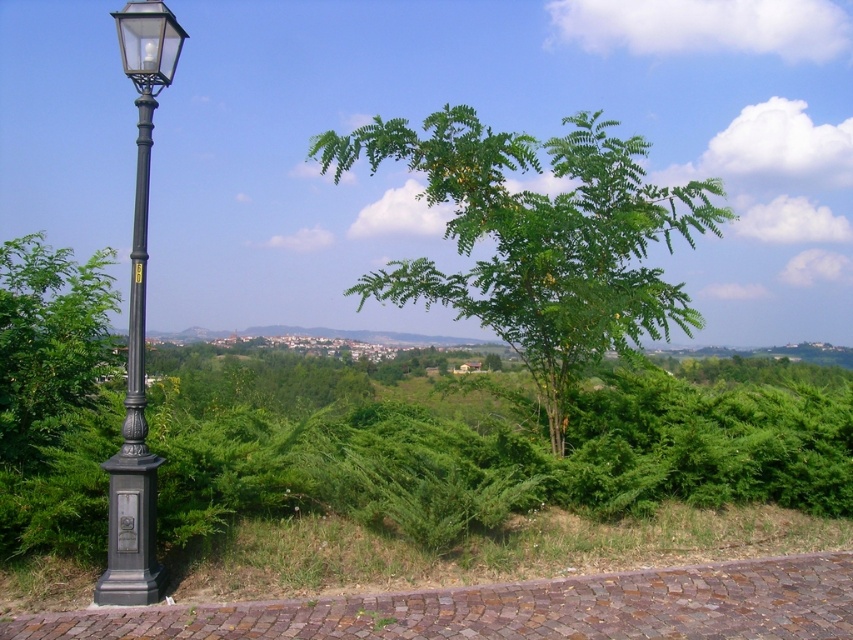
You are standing at the starting point of the cobblestone pathway and want to walk towards the green leafy tree at center. Which direction should you head relative to the pathway?

The green leafy tree at center is located at point (538, 237), which is to the left of the pathway. You should head towards the left direction relative to the pathway to reach it.